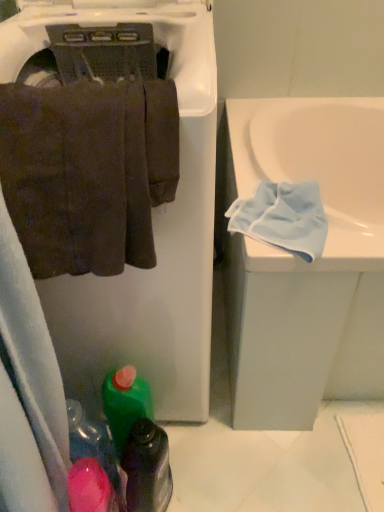
Question: From a real-world perspective, relative to white matte dishwasher at upper left, is brown cotton towel at left vertically above or below?

Choices:
 (A) above
 (B) below

Answer: (A)

Question: Which is correct: brown cotton towel at left is inside white matte dishwasher at upper left, or outside of it?

Choices:
 (A) outside
 (B) inside

Answer: (B)

Question: Based on their relative distances, which object is nearer to the green plastic bottle at lower center, acting as the 1th bottle starting from the left?

Choices:
 (A) brown cotton towel at left
 (B) white matte dishwasher at upper left
 (C) green plastic bottle at lower center, placed as the 1th bottle when sorted from right to left
 (D) light blue microfiber cloth at right

Answer: (C)

Question: Considering the real-world distances, which object is closest to the white matte dishwasher at upper left?

Choices:
 (A) light blue microfiber cloth at right
 (B) green plastic bottle at lower center, acting as the 1th bottle starting from the left
 (C) green plastic bottle at lower center, placed as the 1th bottle when sorted from right to left
 (D) brown cotton towel at left

Answer: (D)